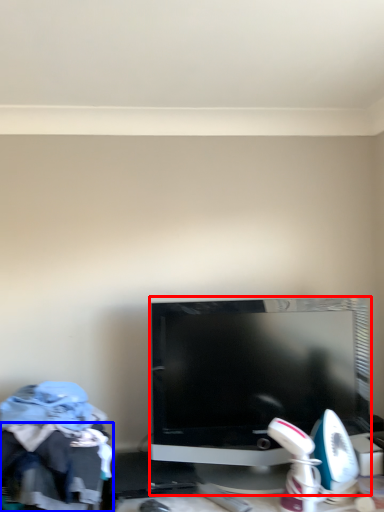
Question: Which point is further to the camera, television (highlighted by a red box) or clothing (highlighted by a blue box)?

Choices:
 (A) television
 (B) clothing

Answer: (A)